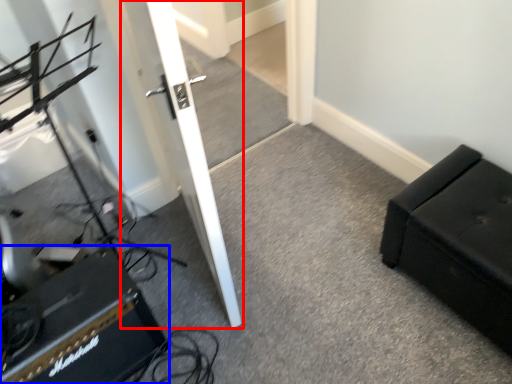
Question: Among these objects, which one is nearest to the camera, door (highlighted by a red box) or speaker (highlighted by a blue box)?

Choices:
 (A) door
 (B) speaker

Answer: (A)